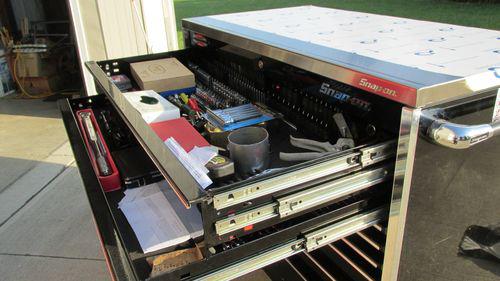
Where is `cords`? The width and height of the screenshot is (500, 281). cords is located at coordinates (23, 71), (12, 67).